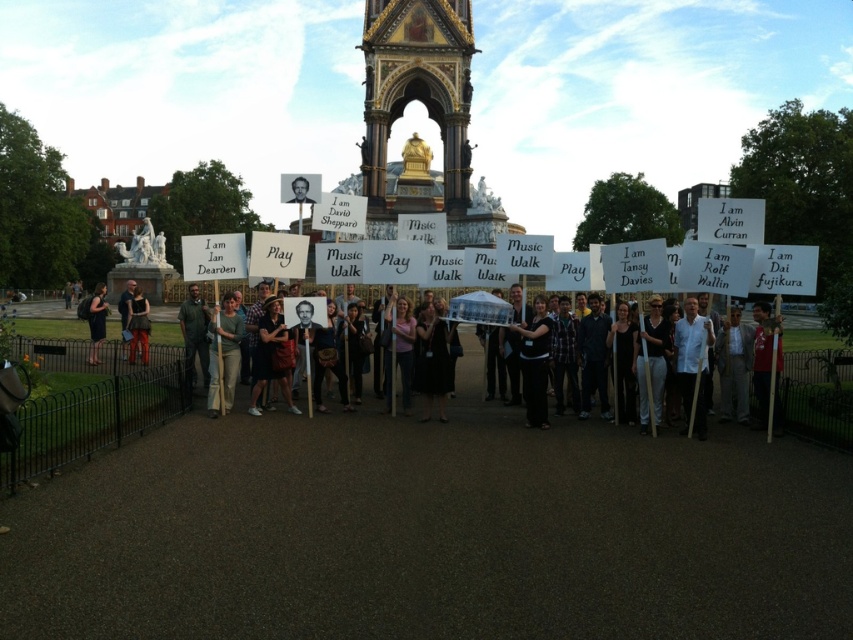
Which is below, matte black dress at center or dark brown leather jacket at center?

matte black dress at center is below.

This screenshot has width=853, height=640. I want to click on matte black dress at center, so click(138, 324).

Which is behind, point (148, 321) or point (129, 316)?

The point (148, 321) is more distant.

At what (x,y) coordinates should I click in order to perform the action: click on matte black dress at center. Please return your answer as a coordinate pair (x, y). Looking at the image, I should click on (138, 324).

Does green cotton shirt at center appear under black fabric dress at lower left?

Yes, green cotton shirt at center is below black fabric dress at lower left.

Is point (236, 314) in front of point (97, 348)?

That is True.

What do you see at coordinates (223, 356) in the screenshot? I see `green cotton shirt at center` at bounding box center [223, 356].

Image resolution: width=853 pixels, height=640 pixels. Identify the location of green cotton shirt at center. (223, 356).

You are a GUI agent. You are given a task and a screenshot of the screen. Output one action in this format:
    pyautogui.click(x=<x>, y=<y>)
    Task: Click on the green cotton shirt at center
    The width and height of the screenshot is (853, 640).
    Given the screenshot: What is the action you would take?
    pyautogui.click(x=223, y=356)

Is green cotton shirt at center to the right of dark brown leather jacket at center from the viewer's perspective?

Indeed, green cotton shirt at center is positioned on the right side of dark brown leather jacket at center.

Describe the element at coordinates (223, 356) in the screenshot. I see `green cotton shirt at center` at that location.

Where is `green cotton shirt at center`? This screenshot has height=640, width=853. green cotton shirt at center is located at coordinates (223, 356).